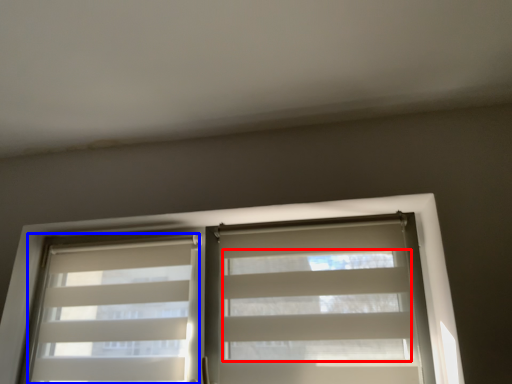
Question: Which object appears closest to the camera in this image, blind (highlighted by a red box) or shutter (highlighted by a blue box)?

Choices:
 (A) blind
 (B) shutter

Answer: (A)